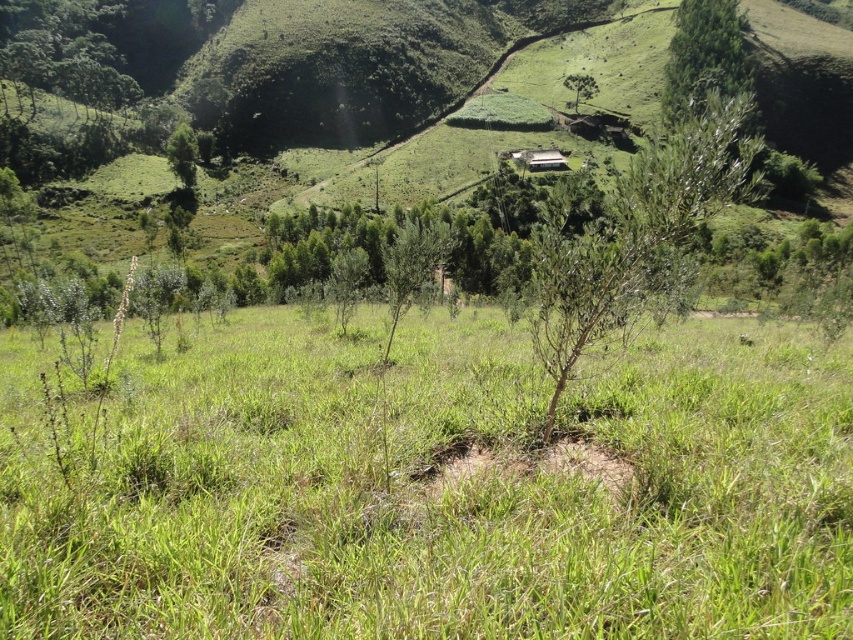
Question: Which of the following is the farthest from the observer?

Choices:
 (A) (511, 157)
 (B) (625, 284)
 (C) (704, 36)
 (D) (392, 285)

Answer: (C)

Question: Which object is the farthest from the white corrugated metal hut at upper center?

Choices:
 (A) green grassy at center
 (B) green leafy tree at upper right
 (C) green leafy tree at upper center
 (D) green leafy tree at center

Answer: (A)

Question: Considering the real-world distances, which object is farthest from the green leafy tree at center?

Choices:
 (A) green leafy tree at upper left
 (B) green grassy at center
 (C) green leafy tree at upper center

Answer: (C)

Question: Is green leafy tree at upper left closer to camera compared to white corrugated metal hut at upper center?

Choices:
 (A) no
 (B) yes

Answer: (B)

Question: Does green leafy tree at upper right appear under green leafy tree at center?

Choices:
 (A) no
 (B) yes

Answer: (A)

Question: Is green grassy at center positioned before white corrugated metal hut at upper center?

Choices:
 (A) no
 (B) yes

Answer: (B)